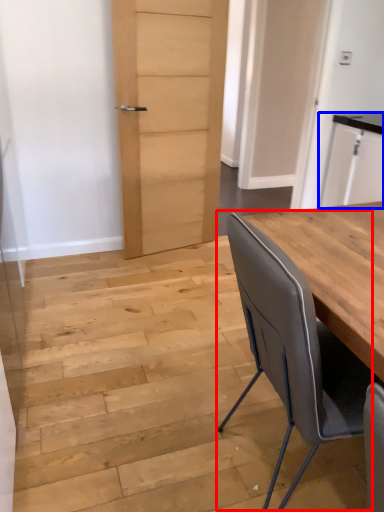
Question: Which point is closer to the camera, chair (highlighted by a red box) or cabinetry (highlighted by a blue box)?

Choices:
 (A) chair
 (B) cabinetry

Answer: (A)